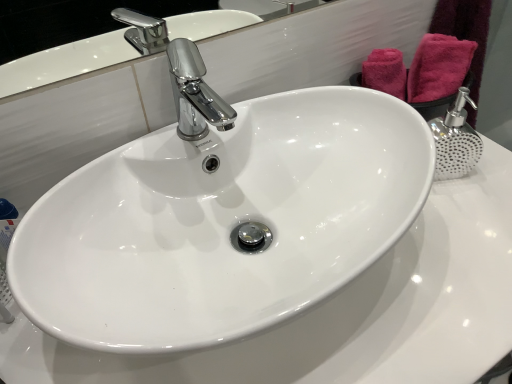
Question: From their relative heights in the image, would you say white glossy sink at center is taller or shorter than pink fabric towel at upper right?

Choices:
 (A) short
 (B) tall

Answer: (B)

Question: Is white glossy sink at center to the left or to the right of pink fabric towel at upper right in the image?

Choices:
 (A) right
 (B) left

Answer: (B)

Question: Does point (122, 218) appear closer or farther from the camera than point (407, 89)?

Choices:
 (A) farther
 (B) closer

Answer: (B)

Question: Considering the relative positions of pink fabric towel at upper right and white glossy sink at center in the image provided, is pink fabric towel at upper right to the left or to the right of white glossy sink at center?

Choices:
 (A) right
 (B) left

Answer: (A)

Question: From a real-world perspective, is pink fabric towel at upper right above or below white glossy sink at center?

Choices:
 (A) below
 (B) above

Answer: (B)

Question: Is pink fabric towel at upper right spatially inside white glossy sink at center, or outside of it?

Choices:
 (A) inside
 (B) outside

Answer: (B)

Question: From the image's perspective, relative to white glossy sink at center, is pink fabric towel at upper right above or below?

Choices:
 (A) above
 (B) below

Answer: (A)